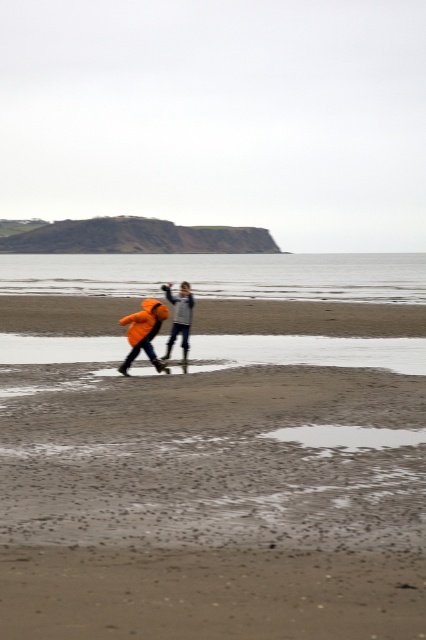
Between sandy beach at center and orange fabric jacket at center, which one is positioned lower?

sandy beach at center

Does sandy beach at center have a greater height compared to orange fabric jacket at center?

No.

Between point (206, 368) and point (184, 337), which one is positioned in front?

Point (206, 368)

This screenshot has height=640, width=426. I want to click on sandy beach at center, so click(x=201, y=492).

In order to click on sandy beach at center in this screenshot , I will do `click(201, 492)`.

Is sandy beach at center thinner than orange waterproof jacket at center?

No.

Does point (399, 493) come closer to viewer compared to point (164, 369)?

Yes, point (399, 493) is in front of point (164, 369).

Locate an element on the screen. This screenshot has width=426, height=640. sandy beach at center is located at coordinates (201, 492).

Does orange waterproof jacket at center have a lesser width compared to orange fabric jacket at center?

In fact, orange waterproof jacket at center might be wider than orange fabric jacket at center.

Between point (131, 362) and point (186, 316), which one is positioned in front?

Positioned in front is point (131, 362).

What do you see at coordinates (143, 333) in the screenshot?
I see `orange waterproof jacket at center` at bounding box center [143, 333].

This screenshot has width=426, height=640. I want to click on orange waterproof jacket at center, so [143, 333].